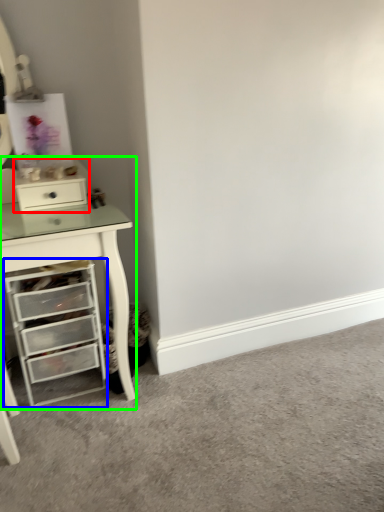
Question: Estimate the real-world distances between objects in this image. Which object is farther from file cabinet (highlighted by a red box), chest of drawers (highlighted by a blue box) or computer desk (highlighted by a green box)?

Choices:
 (A) chest of drawers
 (B) computer desk

Answer: (A)